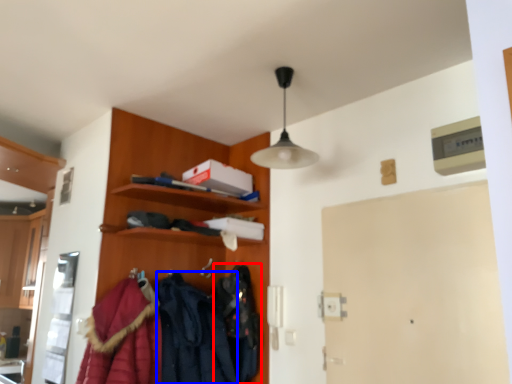
Question: Which point is closer to the camera, clothing (highlighted by a red box) or clothing (highlighted by a blue box)?

Choices:
 (A) clothing
 (B) clothing

Answer: (B)